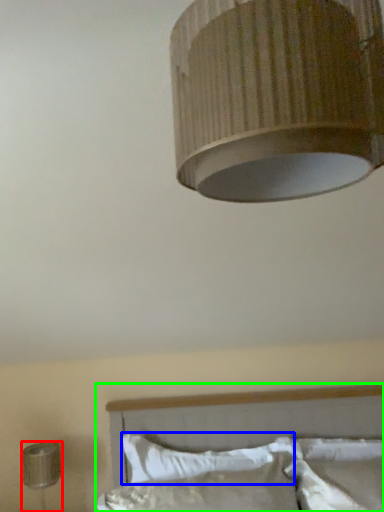
Question: Considering the real-world distances, which object is closest to lamp (highlighted by a red box)? pillow (highlighted by a blue box) or bed (highlighted by a green box).

Choices:
 (A) pillow
 (B) bed

Answer: (A)